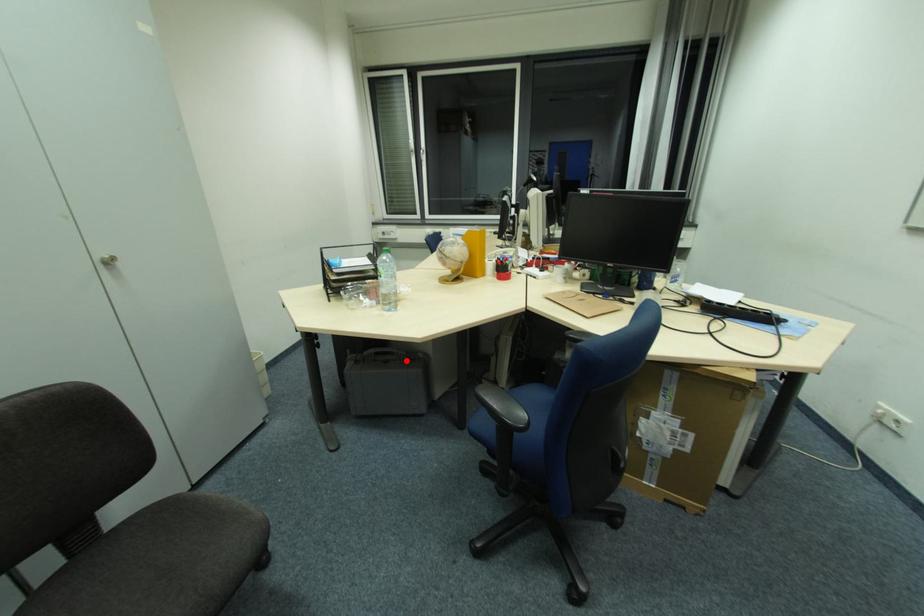
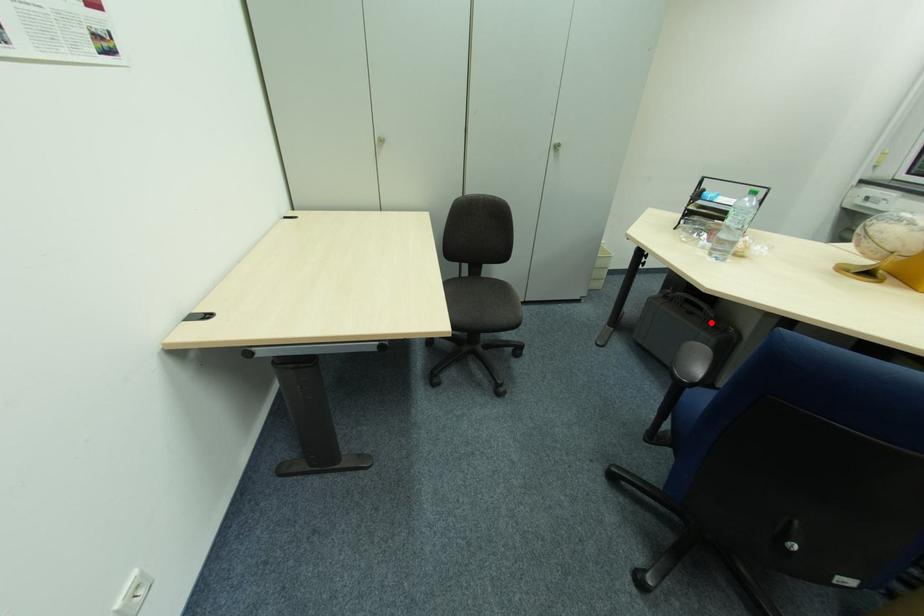
I am providing you with two images of the same scene from different viewpoints. A red point is marked on the first image and another point is marked on the second image. Are the points marked in image1 and image2 representing the same 3D position?

Yes